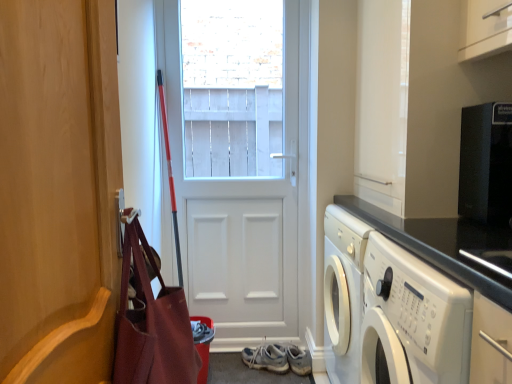
At what (x,y) coordinates should I click in order to perform the action: click on free space to the left of light blue fabric sneakers at center. Please return your answer as a coordinate pair (x, y). Looking at the image, I should click on (240, 364).